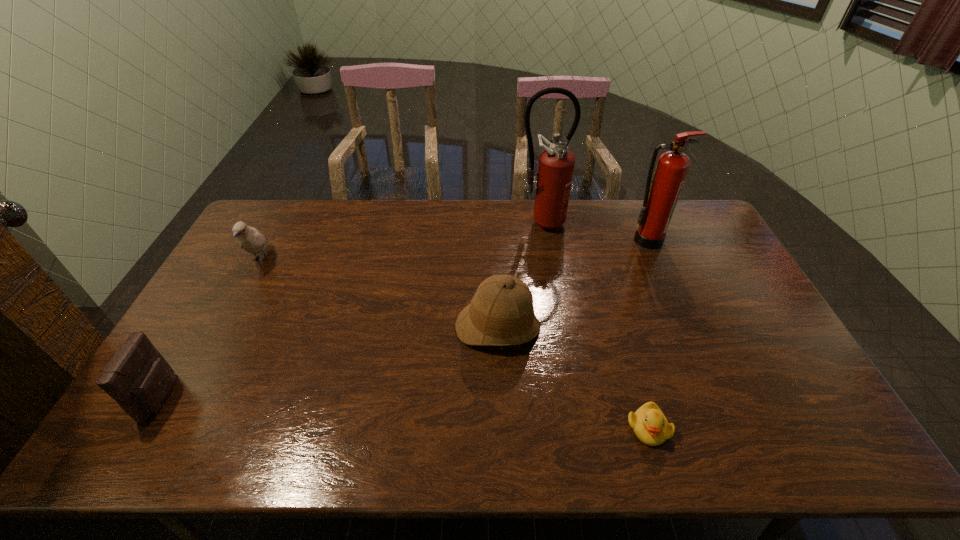
This screenshot has width=960, height=540. I want to click on free space located 0.120m with the nozzle pointing from the back of the shorter fire extinguisher, so click(x=661, y=273).

Find the location of a particular element. This screenshot has height=540, width=960. free space located 0.070m on the front-facing side of the hat is located at coordinates (500, 377).

Where is `free space located 0.360m at the beak of the bird`? free space located 0.360m at the beak of the bird is located at coordinates (202, 370).

Image resolution: width=960 pixels, height=540 pixels. Find the location of `vacant region located with an open flap on the leftmost object`. vacant region located with an open flap on the leftmost object is located at coordinates (237, 397).

This screenshot has width=960, height=540. Find the location of `pouch that is at the near edge`. pouch that is at the near edge is located at coordinates (138, 378).

Find the location of a particular element. The image size is (960, 540). duckling located at the near edge is located at coordinates (649, 424).

The image size is (960, 540). What are the coordinates of `bird located at the left edge` in the screenshot? It's located at [x=250, y=239].

The image size is (960, 540). In order to click on pouch that is at the left edge in this screenshot , I will do `click(138, 378)`.

Identify the location of object that is at the near left corner. Image resolution: width=960 pixels, height=540 pixels. (138, 378).

The image size is (960, 540). In the image, there is a desktop. In order to click on vacant space at the far edge in this screenshot , I will do `click(354, 228)`.